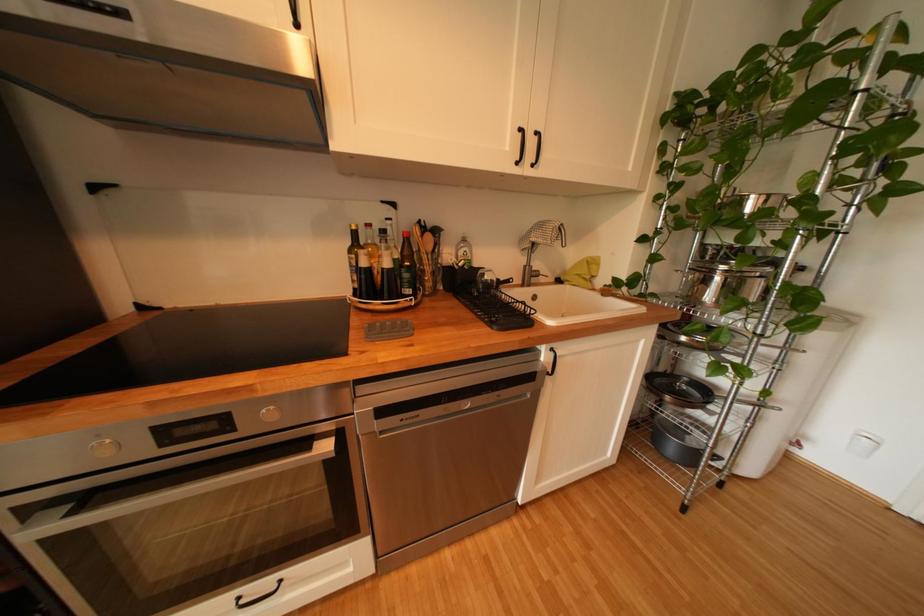
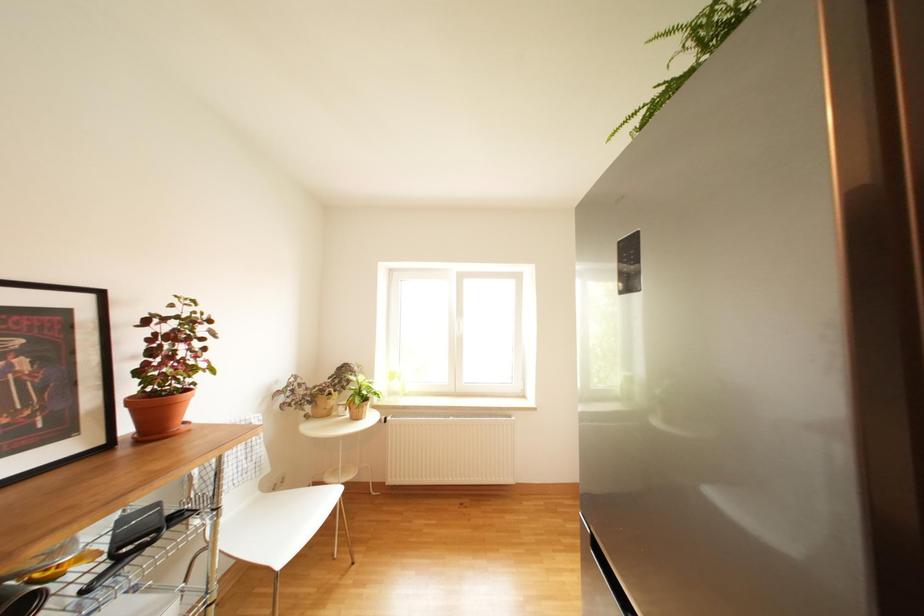
Question: The camera is either moving clockwise (left) or counter-clockwise (right) around the object. The first image is from the beginning of the video and the second image is from the end. Is the camera moving left or right when shooting the video?

Choices:
 (A) Left
 (B) Right

Answer: (B)